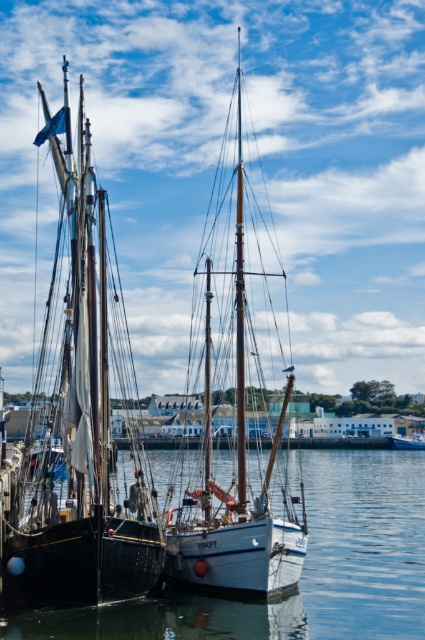
Is point (329, 449) positioned before point (410, 444)?

No, it is not.

Can you confirm if clear water at center is smaller than white matte boat at center?

No, clear water at center is not smaller than white matte boat at center.

Where is `clear water at center`? clear water at center is located at coordinates (303, 568).

Does clear water at center appear under white matte sailboat at center?

Correct, clear water at center is located below white matte sailboat at center.

Which is more to the right, clear water at center or white matte sailboat at center?

From the viewer's perspective, clear water at center appears more on the right side.

Is point (323, 616) positioned before point (243, 433)?

Yes, point (323, 616) is in front of point (243, 433).

The height and width of the screenshot is (640, 425). What are the coordinates of `clear water at center` in the screenshot? It's located at (303, 568).

Can you confirm if matte black sailboat at left is wider than clear water at center?

No, matte black sailboat at left is not wider than clear water at center.

Can you confirm if matte black sailboat at left is smaller than clear water at center?

No, matte black sailboat at left is not smaller than clear water at center.

Is point (87, 400) more distant than point (401, 467)?

No, it is in front of (401, 467).

At what (x,y) coordinates should I click in order to perform the action: click on matte black sailboat at left. Please return your answer as a coordinate pair (x, y). This screenshot has height=640, width=425. Looking at the image, I should click on (79, 417).